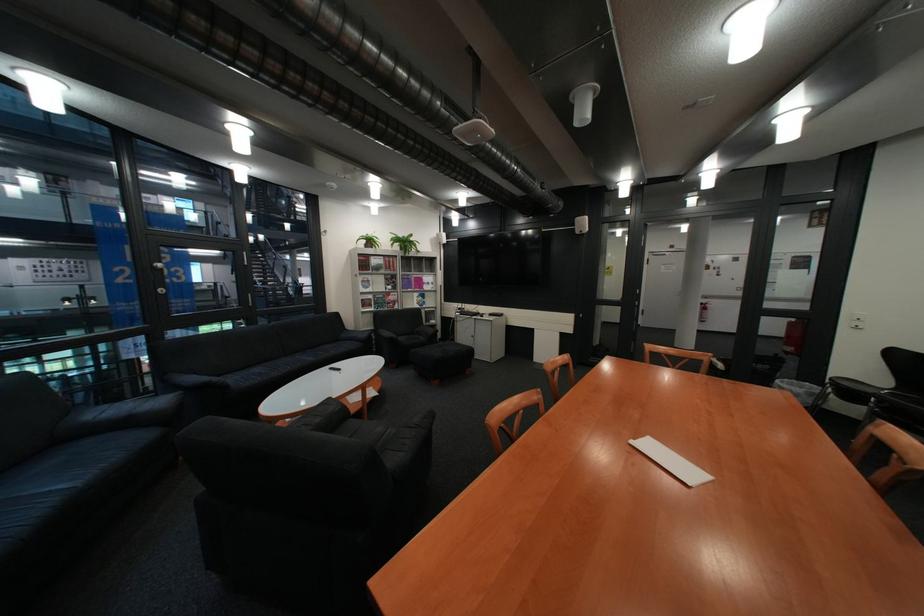
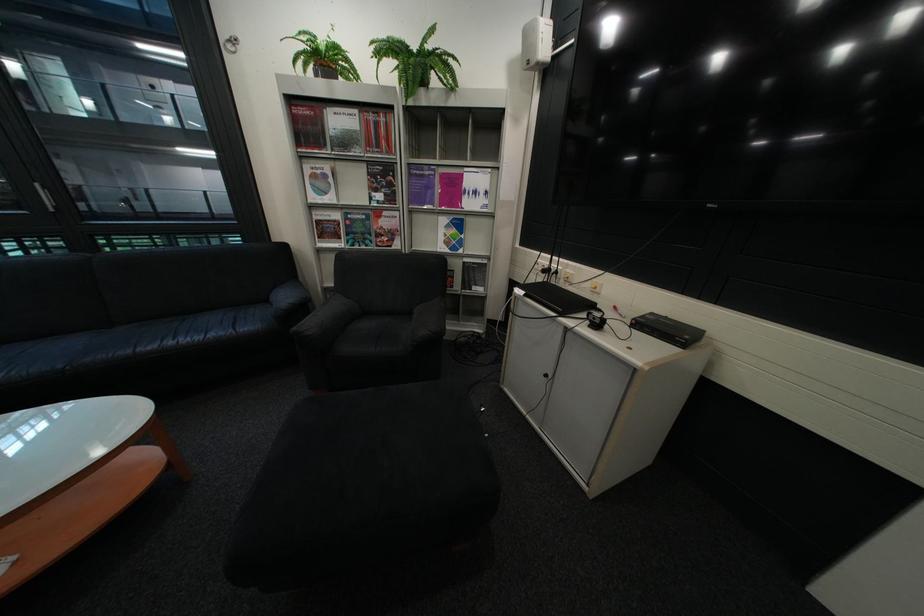
Find the pixel in the second image that matches (379,282) in the first image.

(329, 177)